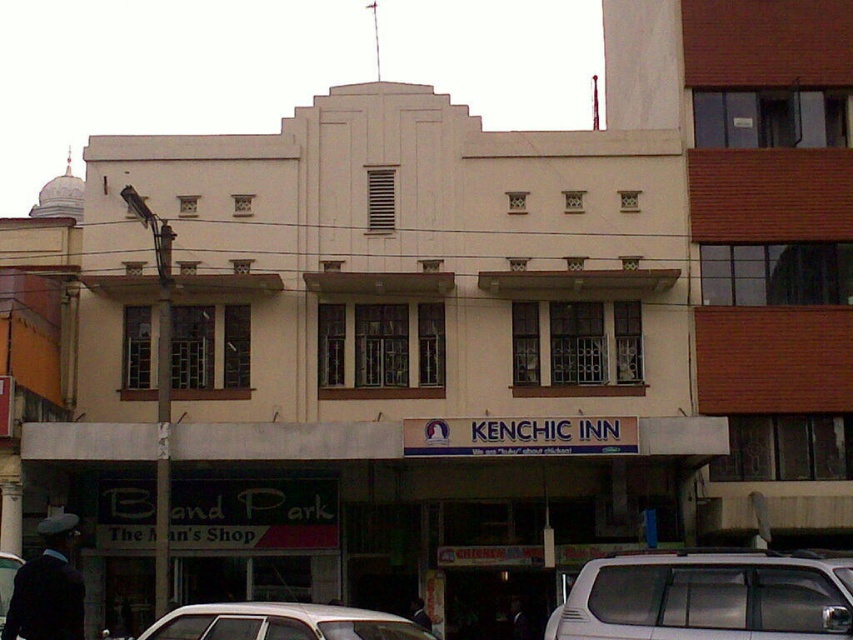
Question: Does white matte car at center appear under dark blue suit at lower left?

Choices:
 (A) yes
 (B) no

Answer: (A)

Question: Which point is closer to the camera?

Choices:
 (A) (321, 609)
 (B) (49, 522)

Answer: (A)

Question: Among these objects, which one is nearest to the camera?

Choices:
 (A) white matte van at lower right
 (B) dark blue suit at lower left
 (C) white matte car at center

Answer: (C)

Question: Can you confirm if white matte car at center is positioned to the right of dark blue suit at lower left?

Choices:
 (A) yes
 (B) no

Answer: (A)

Question: Which point is farther to the camera?

Choices:
 (A) (349, 618)
 (B) (654, 632)

Answer: (B)

Question: Is white matte van at lower right below white matte car at center?

Choices:
 (A) yes
 (B) no

Answer: (B)